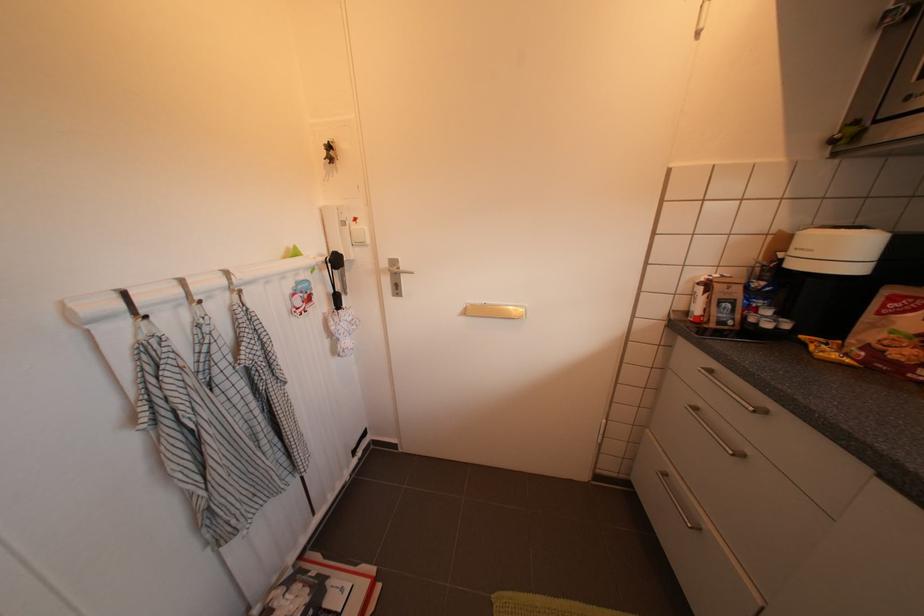
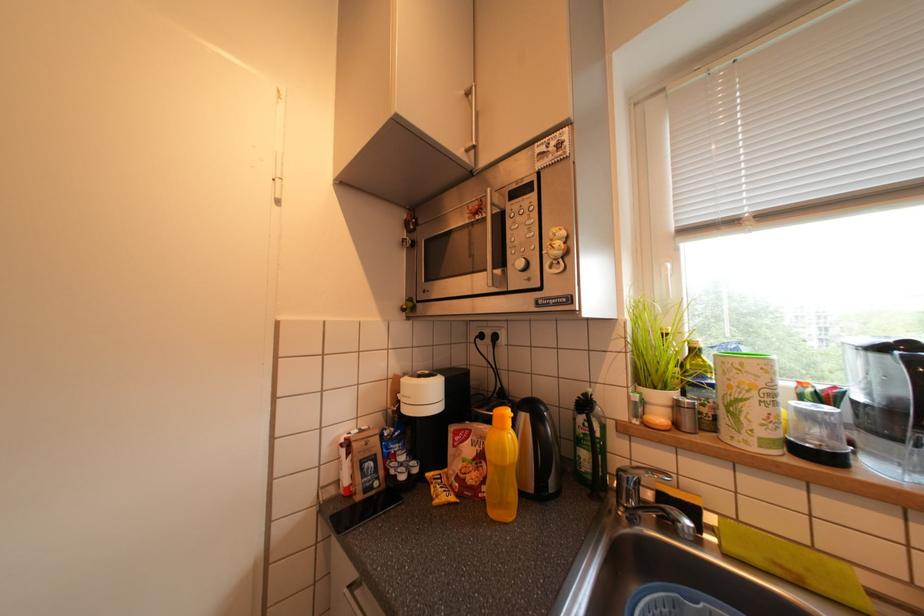
Question: The camera is either moving clockwise (left) or counter-clockwise (right) around the object. The first image is from the beginning of the video and the second image is from the end. Is the camera moving left or right when shooting the video?

Choices:
 (A) Left
 (B) Right

Answer: (A)